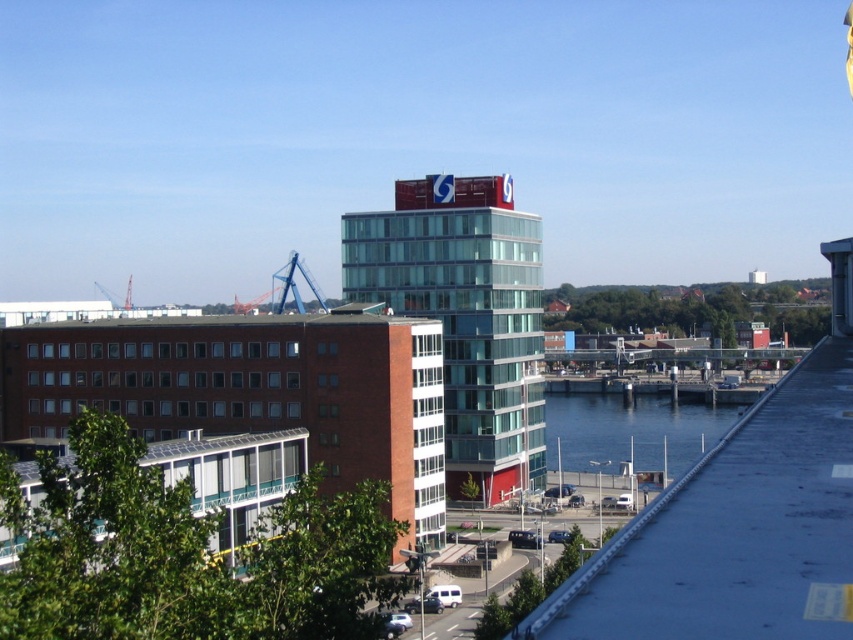
From the picture: Who is higher up, glassy blue building at center or blue water at lower center?

glassy blue building at center

Is glassy blue building at center positioned before blue water at lower center?

Yes, it is.

Where is `glassy blue building at center`? Image resolution: width=853 pixels, height=640 pixels. glassy blue building at center is located at coordinates (465, 316).